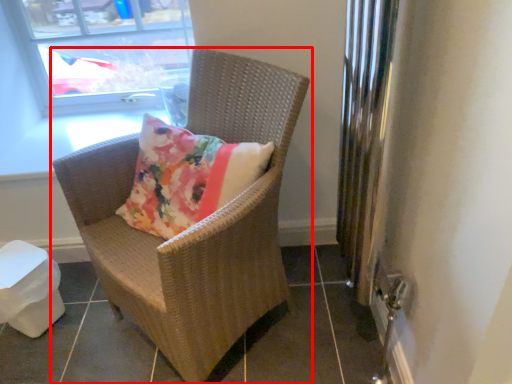
Question: From the image's perspective, where is chair (annotated by the red box) located relative to window?

Choices:
 (A) above
 (B) below

Answer: (B)